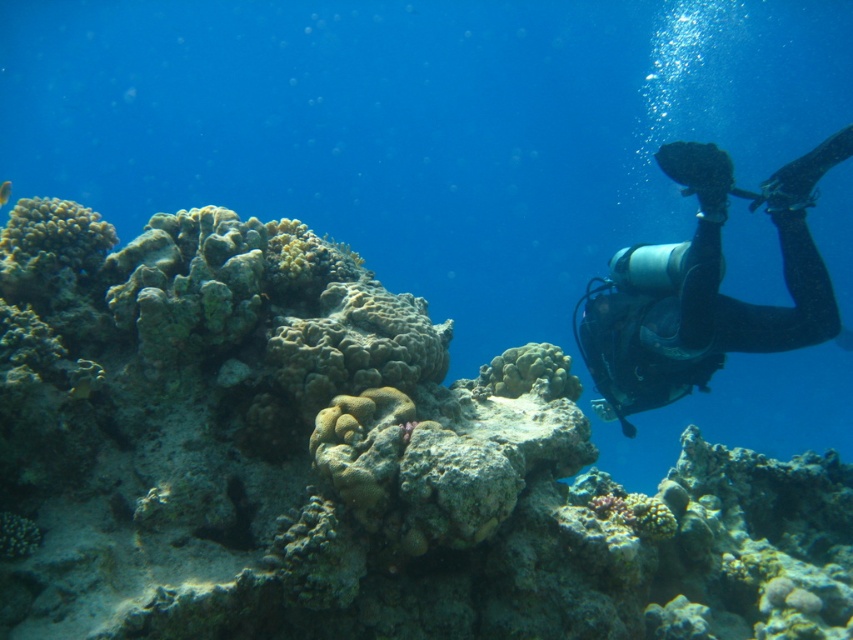
Question: Estimate the real-world distances between objects in this image. Which object is farther from the green textured coral reef at center?

Choices:
 (A) black rubber scuba diver at right
 (B) shiny blue fish at upper left

Answer: (B)

Question: In this image, where is green textured coral reef at center located relative to shiny blue fish at upper left?

Choices:
 (A) above
 (B) below

Answer: (B)

Question: Which of the following is the farthest from the observer?

Choices:
 (A) black rubber scuba diver at right
 (B) shiny blue fish at upper left
 (C) green textured coral reef at center

Answer: (B)

Question: Observing the image, what is the correct spatial positioning of green textured coral reef at center in reference to shiny blue fish at upper left?

Choices:
 (A) left
 (B) right

Answer: (B)

Question: Is green textured coral reef at center further to the viewer compared to black rubber scuba diver at right?

Choices:
 (A) no
 (B) yes

Answer: (A)

Question: Among these objects, which one is nearest to the camera?

Choices:
 (A) green textured coral reef at center
 (B) shiny blue fish at upper left
 (C) black rubber scuba diver at right

Answer: (A)